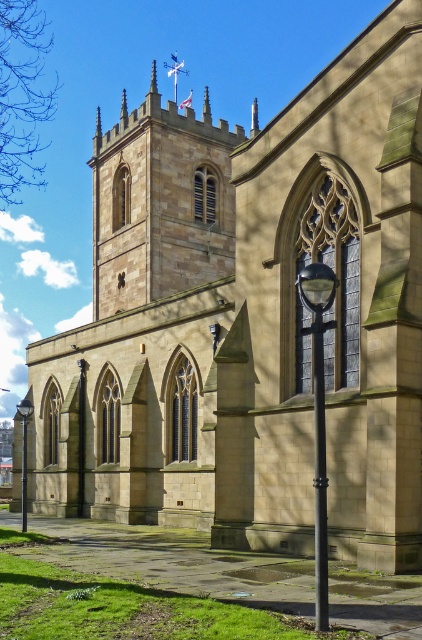
Question: Among these points, which one is nearest to the camera?

Choices:
 (A) (322, 596)
 (B) (186, 236)
 (C) (24, 481)
 (D) (23, 417)

Answer: (A)

Question: Is black glass lamp post at lower left behind black metal pole at center?

Choices:
 (A) no
 (B) yes

Answer: (B)

Question: From the image, what is the correct spatial relationship of black metal/texture lamp post at center-right in relation to black metal pole at lower center?

Choices:
 (A) right
 (B) left

Answer: (A)

Question: Considering the real-world distances, which object is farthest from the black glass lamp post at lower left?

Choices:
 (A) black metal pole at center
 (B) black metal pole at lower center
 (C) black metal/texture lamp post at center-right
 (D) brown stone tower at upper center

Answer: (B)

Question: Does brown stone tower at upper center appear on the left side of black glass lamp post at lower left?

Choices:
 (A) yes
 (B) no

Answer: (B)

Question: Which object is positioned closest to the brown stone tower at upper center?

Choices:
 (A) black glass lamp post at lower left
 (B) black metal/texture lamp post at center-right
 (C) black metal pole at center
 (D) black metal pole at lower center

Answer: (A)